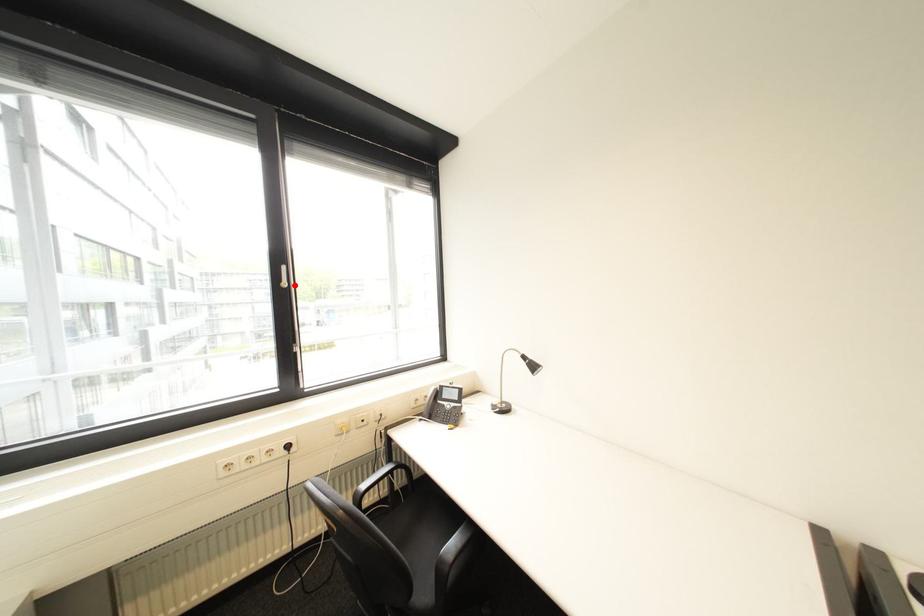
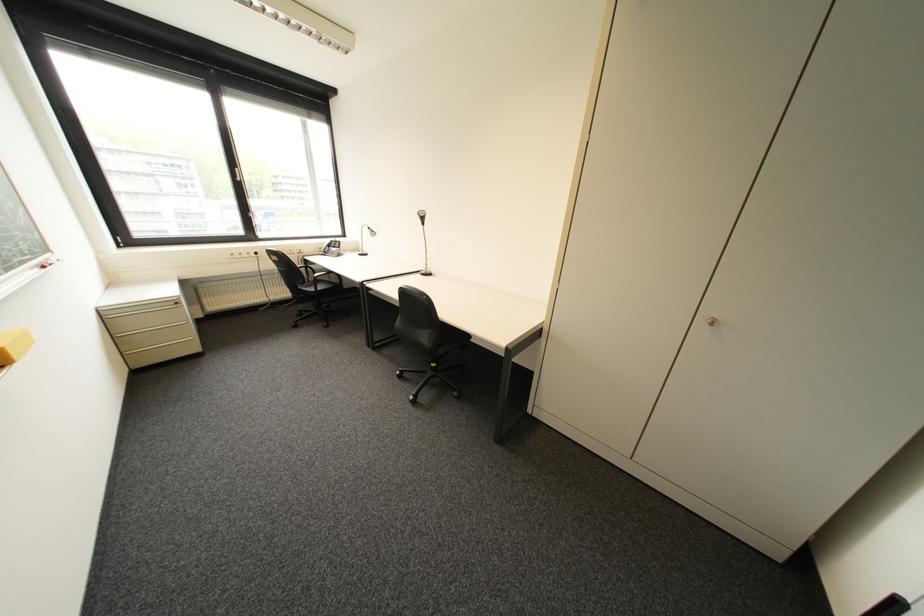
Locate, in the second image, the point that corresponds to the highlighted location in the first image.

(249, 180)